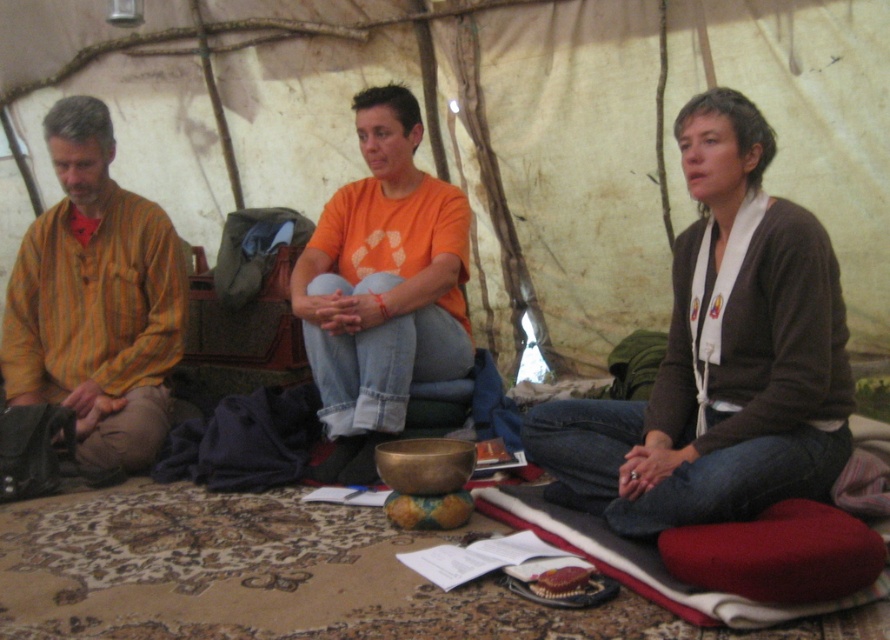
How distant is brown cardigan at center from orange cotton t-shirt at center?

brown cardigan at center is 32.21 inches away from orange cotton t-shirt at center.

Between point (696, 340) and point (387, 266), which one is positioned in front?

Point (696, 340) is more forward.

Find the location of a particular element. This screenshot has width=890, height=640. brown cardigan at center is located at coordinates (719, 356).

Which is behind, point (62, 285) or point (377, 196)?

Point (62, 285)

Does yellow striped fabric at left appear over orange cotton t-shirt at center?

Incorrect, yellow striped fabric at left is not positioned above orange cotton t-shirt at center.

This screenshot has width=890, height=640. What do you see at coordinates (96, 300) in the screenshot?
I see `yellow striped fabric at left` at bounding box center [96, 300].

The width and height of the screenshot is (890, 640). What are the coordinates of `yellow striped fabric at left` in the screenshot? It's located at (96, 300).

Does brown cardigan at center have a lesser width compared to yellow striped fabric at left?

In fact, brown cardigan at center might be wider than yellow striped fabric at left.

Who is positioned more to the right, brown cardigan at center or yellow striped fabric at left?

Positioned to the right is brown cardigan at center.

Does point (712, 100) come behind point (109, 307)?

That is False.

Identify the location of brown cardigan at center. (719, 356).